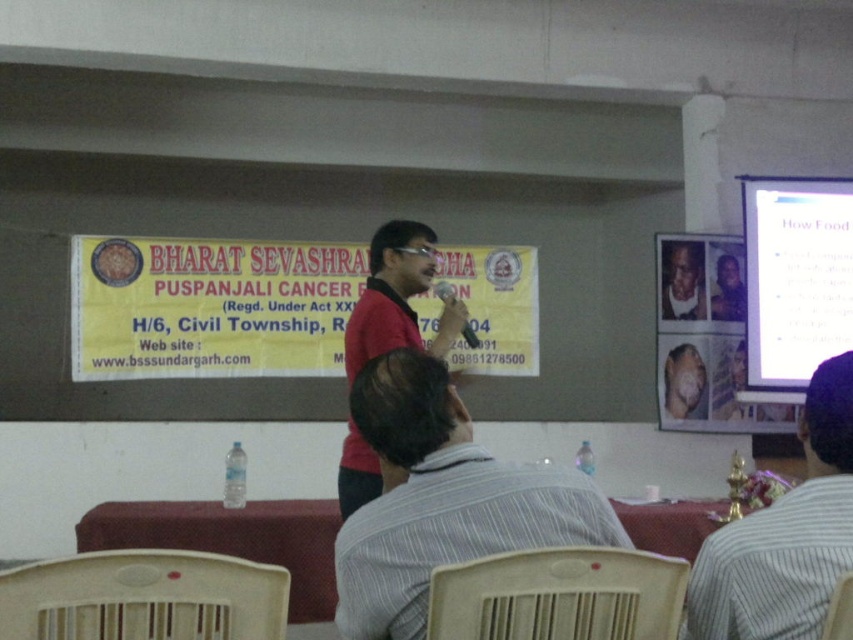
Question: Which of these objects is positioned closest to the red matte shirt at center?

Choices:
 (A) smooth beige skin at center
 (B) smooth skin face at upper right

Answer: (A)

Question: Is plastic chair at lower left thinner than purple glossy photo frame at upper center?

Choices:
 (A) yes
 (B) no

Answer: (B)

Question: Among these points, which one is farthest from the camera?

Choices:
 (A) (733, 307)
 (B) (245, 509)
 (C) (457, 433)
 (D) (202, 627)

Answer: (A)

Question: Estimate the real-world distances between objects in this image. Which object is farther from the smooth beige skin at center?

Choices:
 (A) striped cotton shirt at center
 (B) white glossy projection screen at upper right
 (C) red matte shirt at center

Answer: (A)

Question: Does gray striped shirt at center have a lesser width compared to maroon plastic table at lower center?

Choices:
 (A) no
 (B) yes

Answer: (B)

Question: Does smooth skin face at upper right appear on the right side of smooth beige skin at center?

Choices:
 (A) no
 (B) yes

Answer: (A)